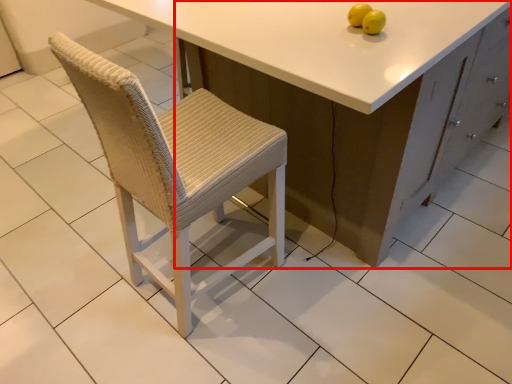
Question: Observing the image, what is the correct spatial positioning of cabinetry (annotated by the red box) in reference to fruit?

Choices:
 (A) left
 (B) right

Answer: (B)